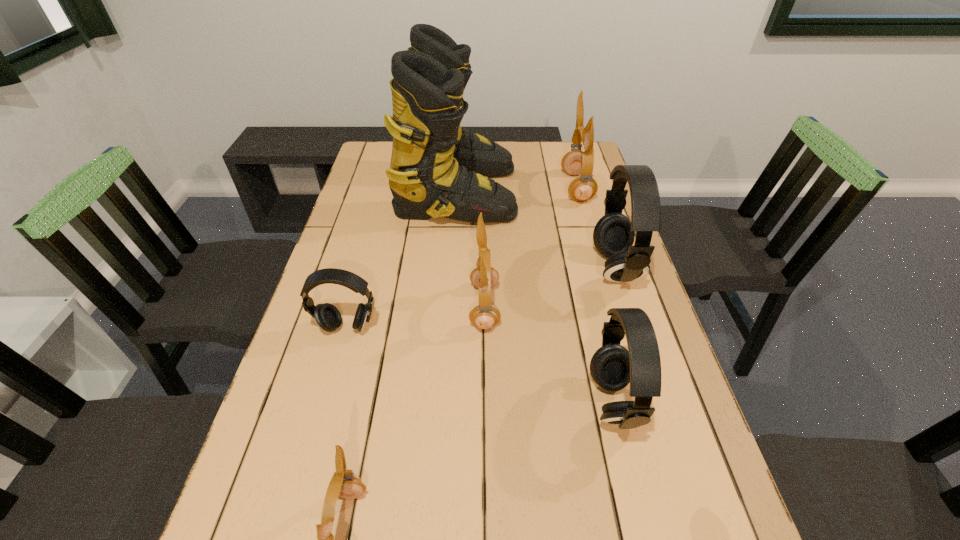
Identify which earphone is located as the fourth nearest to the farthest black earphone. Please provide its 2D coordinates. Your answer should be formatted as a tuple, i.e. [(x, y)], where the tuple contains the x and y coordinates of a point satisfying the conditions above.

[(327, 316)]

Select which brown earphone is the closest to the nearest object. Please provide its 2D coordinates. Your answer should be formatted as a tuple, i.e. [(x, y)], where the tuple contains the x and y coordinates of a point satisfying the conditions above.

[(485, 315)]

Identify which brown earphone is located as the second nearest to the farthest brown earphone. Please provide its 2D coordinates. Your answer should be formatted as a tuple, i.e. [(x, y)], where the tuple contains the x and y coordinates of a point satisfying the conditions above.

[(344, 483)]

Locate which black earphone ranks second in proximity to the fourth earphone from right to left. Please provide its 2D coordinates. Your answer should be formatted as a tuple, i.e. [(x, y)], where the tuple contains the x and y coordinates of a point satisfying the conditions above.

[(327, 316)]

I want to click on the closest black earphone to the second smallest brown earphone, so click(x=612, y=367).

The height and width of the screenshot is (540, 960). Identify the location of free space that satisfies the following two spatial constraints: 1. on the ear cups of the biggest black earphone; 2. on the ear cups of the leftmost black earphone. (634, 327).

This screenshot has height=540, width=960. Identify the location of vacant space that satisfies the following two spatial constraints: 1. on the front-facing side of the rightmost brown earphone; 2. on the ear cups of the second farthest black earphone. (616, 327).